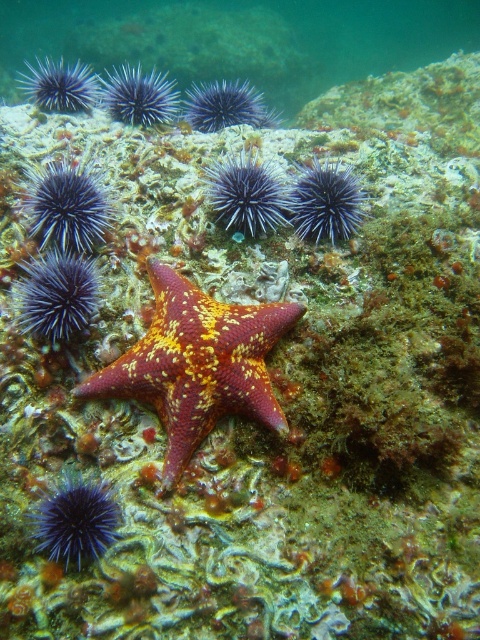
You are a marine biologist studying underwater creatures. You observe the purple spiny sea urchins at upper left and the shiny orange starfish at center in the image. Which of these two creatures is bigger in size?

The purple spiny sea urchins at upper left has a larger size compared to the shiny orange starfish at center.

You are a marine biologist observing this underwater scene. You need to locate the purple spiny sea urchins at upper left relative to the shiny orange starfish at center. Which direction should you look from the starfish to find the sea urchins?

The purple spiny sea urchins at upper left are located to the right of the shiny orange starfish at center. So, from the starfish, you should look to the right to find the sea urchins.

You are a marine biologist studying underwater coordinates. The starfish with a reddish pink body is at the center of the image. You need to locate the purple spiny sea urchins at upper left. What are their coordinates?

The purple spiny sea urchins at upper left are located at coordinates point (241, 38).